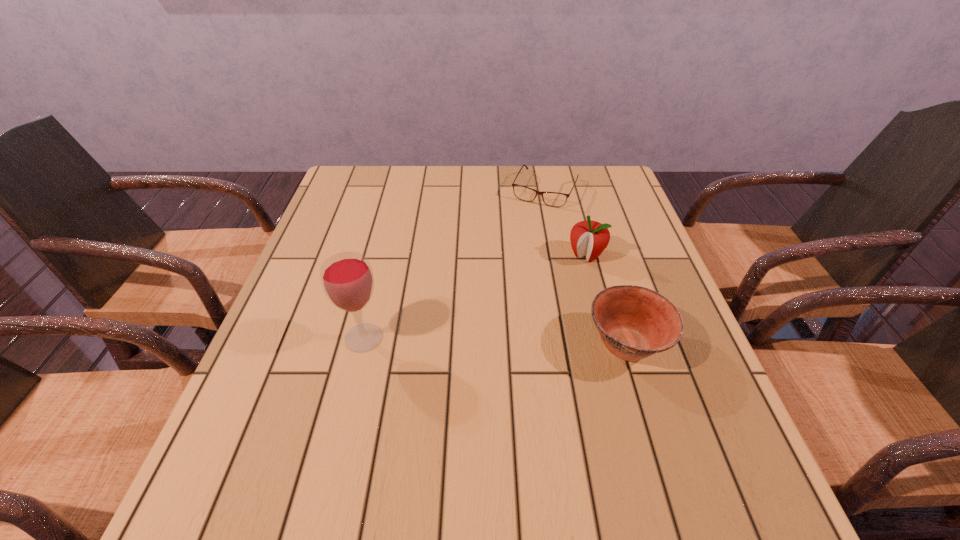
Find the location of a particular element. vacant space that is in between the apple and the spectacles is located at coordinates (565, 222).

I want to click on vacant space in between the third nearest object and the shortest object, so click(565, 222).

The height and width of the screenshot is (540, 960). Identify the location of free space between the leftmost object and the second shortest object. (495, 341).

Locate an element on the screen. The image size is (960, 540). free space between the spectacles and the apple is located at coordinates (565, 222).

The image size is (960, 540). Identify the location of unoccupied area between the farthest object and the tallest object. (454, 264).

Where is `free space between the tallest object and the second farthest object`? This screenshot has width=960, height=540. free space between the tallest object and the second farthest object is located at coordinates tap(475, 296).

Identify which object is the third closest to the spectacles. Please provide its 2D coordinates. Your answer should be formatted as a tuple, i.e. [(x, y)], where the tuple contains the x and y coordinates of a point satisfying the conditions above.

[(347, 279)]

Select which object appears as the second closest to the third nearest object. Please provide its 2D coordinates. Your answer should be formatted as a tuple, i.e. [(x, y)], where the tuple contains the x and y coordinates of a point satisfying the conditions above.

[(554, 199)]

Find the location of `free location that satisfies the following two spatial constraints: 1. on the front side of the third tallest object; 2. on the right side of the second tallest object`. free location that satisfies the following two spatial constraints: 1. on the front side of the third tallest object; 2. on the right side of the second tallest object is located at coordinates (611, 345).

Find the location of a particular element. This screenshot has width=960, height=540. vacant point that satisfies the following two spatial constraints: 1. on the back side of the second tallest object; 2. on the left side of the tallest object is located at coordinates (384, 255).